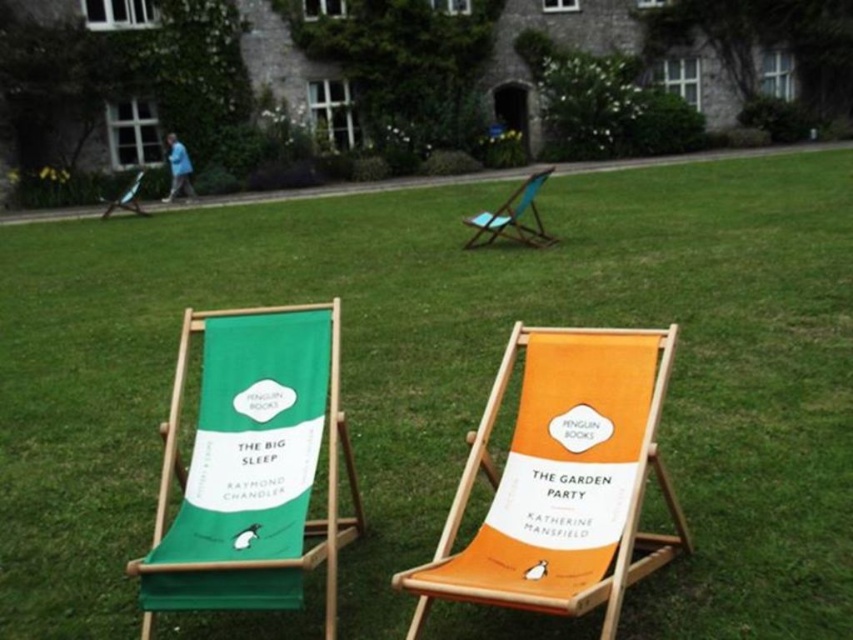
You are standing in the garden looking at the two wooden deck chairs. Which of the two points, point 1 at coordinates point (608,508) or point 2 at coordinates point (480,221), is closer to you?

Point 1 at coordinates point (608,508) is closer to you than point 2 at coordinates point (480,221).

You are planning to place a rectangular picnic basket that is 1.2 meters wide between the orange fabric beach chair at center and the teal fabric chair at upper center. Based on the space between them, will the basket fit without overlapping either chair?

The orange fabric beach chair at center has a lesser width compared to the teal fabric chair at upper center. However, the description does not provide information about the distance between the two chairs. Therefore, it is impossible to determine if the picnic basket will fit without overlapping either chair based on the given details.

You are standing in the garden and want to place a new book cover on the chair that is closer to you. Which chair should you choose between the point at (527, 228) and the point at (131, 189)?

The point at (527, 228) is closer to the viewer than the point at (131, 189), so you should choose the chair at point (527, 228).